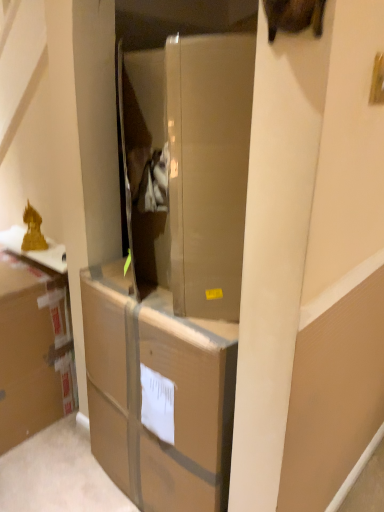
Locate an element on the screen. This screenshot has height=512, width=384. brown cardboard box at left is located at coordinates (33, 350).

Measure the distance between brown cardboard box at left and camera.

A distance of 5.31 feet exists between brown cardboard box at left and camera.

What do you see at coordinates (33, 350) in the screenshot? I see `brown cardboard box at left` at bounding box center [33, 350].

What is the approximate width of brown cardboard box at center?

The width of brown cardboard box at center is 19.05 inches.

This screenshot has height=512, width=384. What do you see at coordinates (158, 394) in the screenshot? I see `brown cardboard box at center` at bounding box center [158, 394].

You are a GUI agent. You are given a task and a screenshot of the screen. Output one action in this format:
    pyautogui.click(x=<x>, y=<y>)
    Task: Click on the brown cardboard box at center
    This screenshot has height=512, width=384.
    Given the screenshot: What is the action you would take?
    pyautogui.click(x=158, y=394)

The image size is (384, 512). Identify the location of brown cardboard box at left. (33, 350).

Considering the positions of objects brown cardboard box at center and brown cardboard box at left in the image provided, who is more to the right, brown cardboard box at center or brown cardboard box at left?

Positioned to the right is brown cardboard box at center.

Considering the positions of objects brown cardboard box at center and brown cardboard box at left in the image provided, who is behind, brown cardboard box at center or brown cardboard box at left?

brown cardboard box at left is behind.

Does point (103, 302) lie behind point (2, 261)?

No, (103, 302) is in front of (2, 261).

From the image's perspective, does brown cardboard box at center appear lower than brown cardboard box at left?

Yes, from the image's perspective, brown cardboard box at center is below brown cardboard box at left.

From a real-world perspective, is brown cardboard box at center positioned above or below brown cardboard box at left?

brown cardboard box at center is situated higher than brown cardboard box at left in the real world.

Is brown cardboard box at center wider or thinner than brown cardboard box at left?

Clearly, brown cardboard box at center has more width compared to brown cardboard box at left.

Can you confirm if brown cardboard box at center is shorter than brown cardboard box at left?

No.

Is brown cardboard box at center bigger than brown cardboard box at left?

Indeed, brown cardboard box at center has a larger size compared to brown cardboard box at left.

Is brown cardboard box at center located outside brown cardboard box at left?

Yes.

Are brown cardboard box at center and brown cardboard box at left far apart?

Actually, brown cardboard box at center and brown cardboard box at left are a little close together.

Is brown cardboard box at center looking in the opposite direction of brown cardboard box at left?

brown cardboard box at center is not turned away from brown cardboard box at left.

The image size is (384, 512). I want to click on cardboard box that appears above the brown cardboard box at center (from the image's perspective), so click(x=33, y=350).

Between brown cardboard box at left and brown cardboard box at center, which one appears on the right side from the viewer's perspective?

brown cardboard box at center is more to the right.

Which object is more forward, brown cardboard box at left or brown cardboard box at center?

brown cardboard box at center.

Is point (23, 336) less distant than point (232, 358)?

No, it is not.

From the image's perspective, between brown cardboard box at left and brown cardboard box at center, which one is located above?

brown cardboard box at left appears higher in the image.

From a real-world perspective, which is physically above, brown cardboard box at left or brown cardboard box at center?

From a 3D spatial view, brown cardboard box at center is above.

Which of these two, brown cardboard box at left or brown cardboard box at center, is wider?

With larger width is brown cardboard box at center.

Between brown cardboard box at left and brown cardboard box at center, which one has more height?

Standing taller between the two is brown cardboard box at center.

From the picture: Considering the sizes of brown cardboard box at left and brown cardboard box at center in the image, is brown cardboard box at left bigger or smaller than brown cardboard box at center?

brown cardboard box at left is smaller than brown cardboard box at center.

Is brown cardboard box at center completely or partially inside brown cardboard box at left?

Definitely not — brown cardboard box at center is not inside brown cardboard box at left.

Is brown cardboard box at left directly adjacent to brown cardboard box at center?

There is a gap between brown cardboard box at left and brown cardboard box at center.

Is brown cardboard box at center at the back of brown cardboard box at left?

That's not correct — brown cardboard box at left is not looking away from brown cardboard box at center.

How different are the orientations of brown cardboard box at left and brown cardboard box at center in degrees?

The angular difference between brown cardboard box at left and brown cardboard box at center is 5.85 degrees.

How much distance is there between brown cardboard box at left and brown cardboard box at center?

brown cardboard box at left and brown cardboard box at center are 20.14 inches apart from each other.

There is a brown cardboard box at left. At what (x,y) coordinates should I click in order to perform the action: click on cabinetry above it (from a real-world perspective). Please return your answer as a coordinate pair (x, y). Image resolution: width=384 pixels, height=512 pixels. Looking at the image, I should click on (158, 394).

Where is `cabinetry in front of the brown cardboard box at left`? The image size is (384, 512). cabinetry in front of the brown cardboard box at left is located at coordinates (158, 394).

Locate an element on the screen. cardboard box above the brown cardboard box at center (from the image's perspective) is located at coordinates (33, 350).